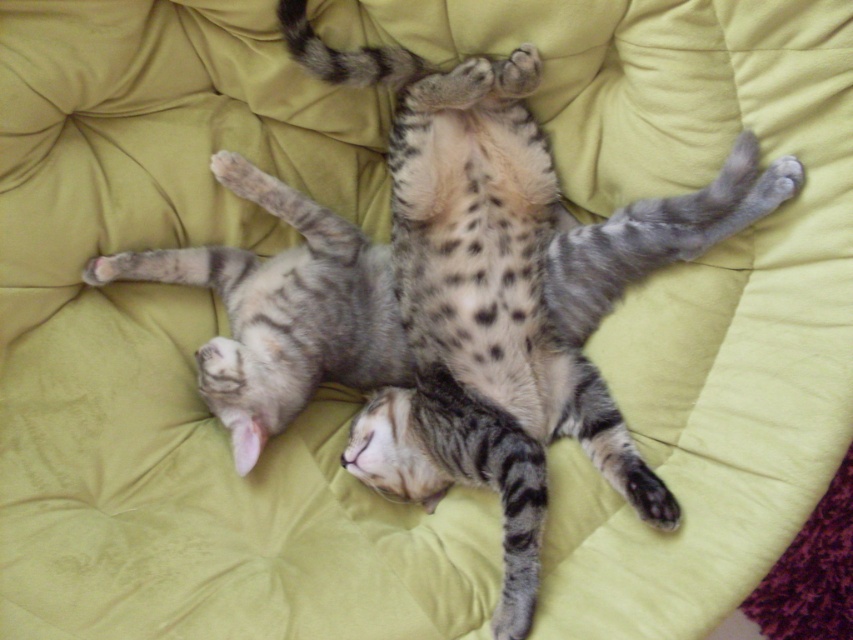
You are taking a photo of two cats lying on a light green cushioned surface. You want to focus on the point closer to the camera. Which point should you choose between point [729,152] and point [282,305]?

Point [729,152] is closer to the camera than point [282,305], so you should choose point [729,152] to focus on the closer point.

You are a cat owner trying to fit both cats into a rectangular pet carrier that is 1 meter wide. Given the spotted fur cat at center and the tabby fur cat at center, will both cats fit side by side in the carrier?

The spotted fur cat at center is wider than the tabby fur cat at center. Since the total width of both cats combined would exceed the carrier width of 1 meter, they cannot fit side by side.